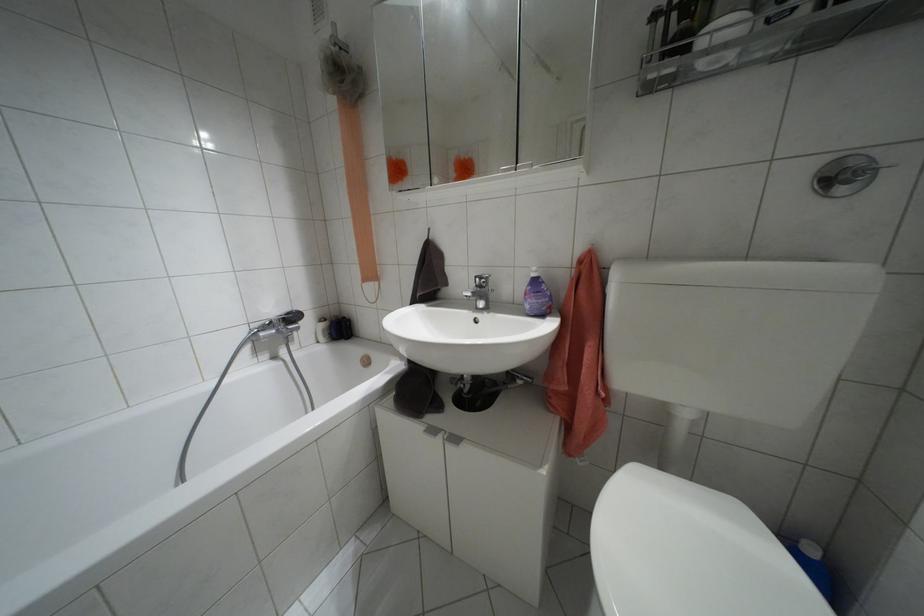
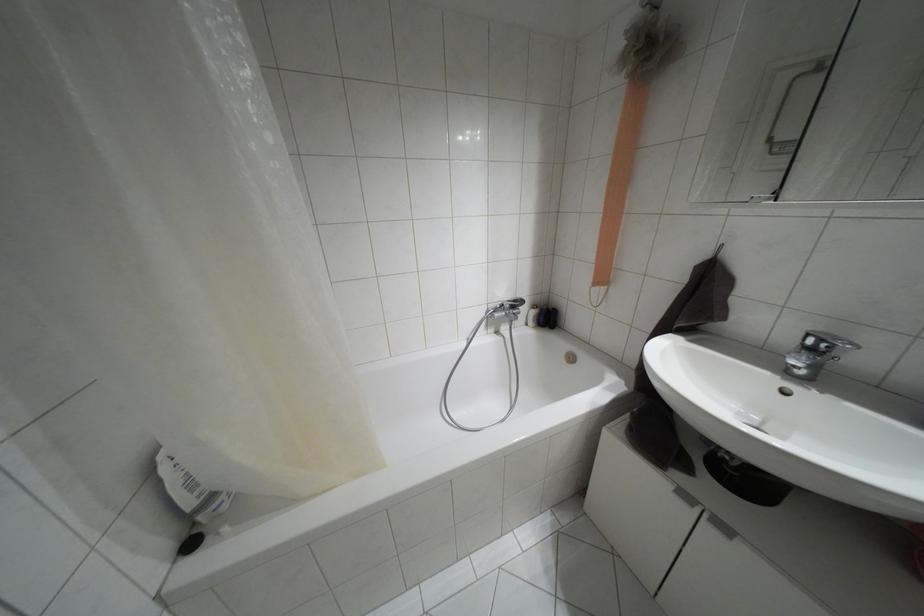
Where in the second image is the point corresponding to (x=286, y=313) from the first image?

(514, 301)